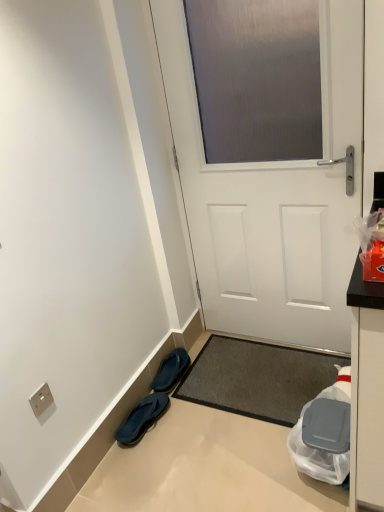
Find the location of a particular element. Image resolution: width=384 pixels, height=512 pixels. free area in between dark gray textured mat at center and blue rubber flip-flops at lower left, which is the 2th footwear in back-to-front order is located at coordinates (206, 432).